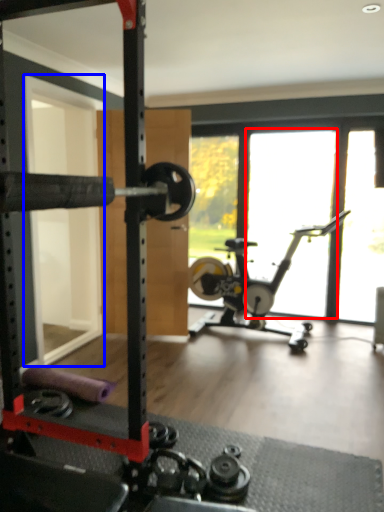
Question: Among these objects, which one is nearest to the camera, window (highlighted by a red box) or screen door (highlighted by a blue box)?

Choices:
 (A) window
 (B) screen door

Answer: (B)